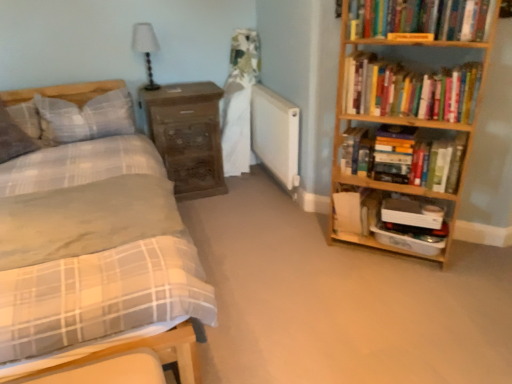
Where is `free space above wooden cabinet at lower right (from a real-world perspective)`? This screenshot has width=512, height=384. free space above wooden cabinet at lower right (from a real-world perspective) is located at coordinates (416, 211).